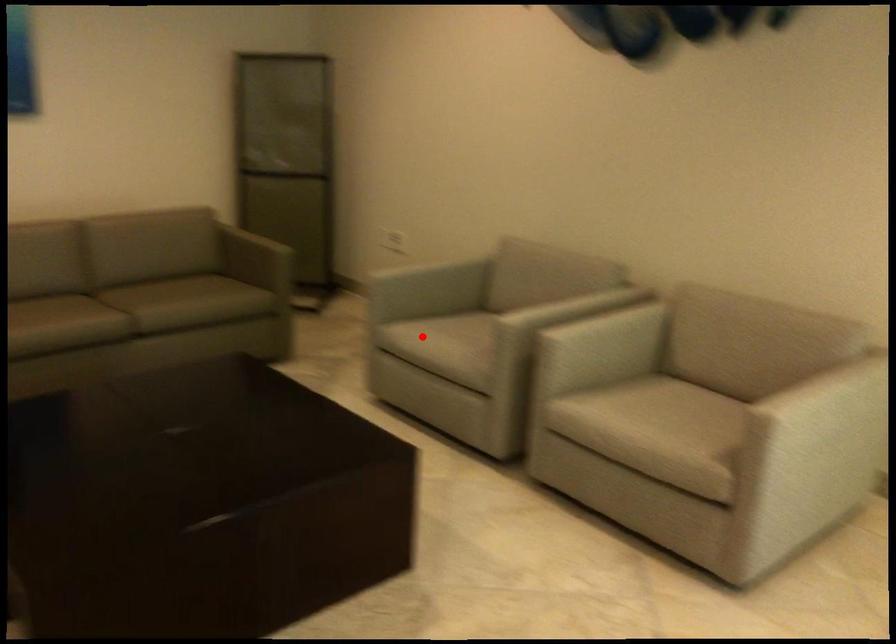
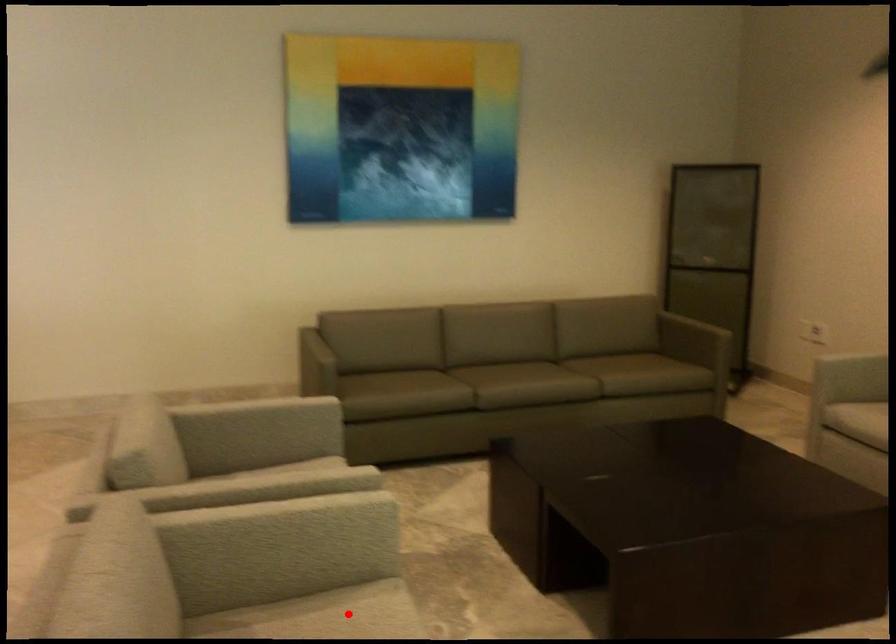
I am providing you with two images of the same scene from different viewpoints. A red point is marked on the first image and another point is marked on the second image. Are the points marked in image1 and image2 representing the same 3D position?

No